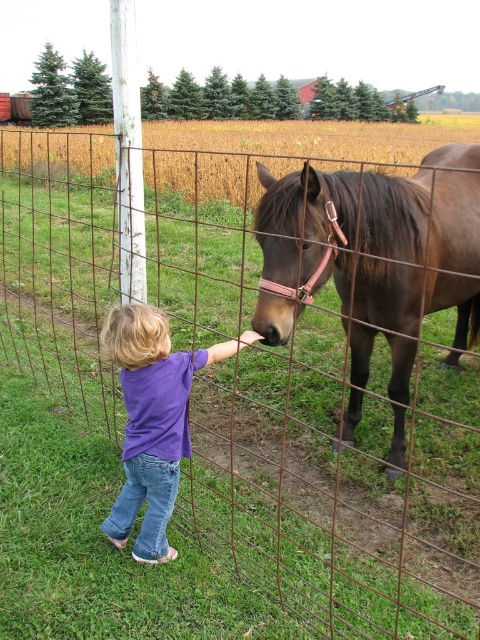
You are a photographer standing at the point marked as point (377, 257). You want to capture a photo of the brown glossy horse at center. Is the horse located exactly where you are standing?

The brown glossy horse at center is located at point (377, 257), so yes, the horse is exactly where you are standing.

You are a photographer trying to capture a photo of the brown glossy horse at center and the purple cotton shirt at center. Based on their heights, which one should you focus on first if you want to ensure both are in frame without adjusting your camera angle?

The brown glossy horse at center is taller than the purple cotton shirt at center, so you should focus on the brown glossy horse at center first to ensure both are in frame without adjusting your camera angle.

You are a photographer taking a picture of the brown glossy horse at center and the purple cotton shirt at center. Which object should you focus on first if you want to capture both in the same frame without moving the camera?

The brown glossy horse at center is located above the purple cotton shirt at center, so you should focus on the purple cotton shirt at center first to ensure both are in focus since it is closer to the camera.